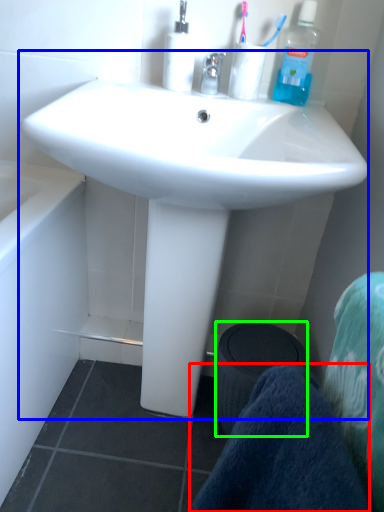
Question: Which object is the farthest from towel/napkin (highlighted by a red box)? Choose among these: sink (highlighted by a blue box) or trash bin/can (highlighted by a green box).

Choices:
 (A) sink
 (B) trash bin/can

Answer: (B)